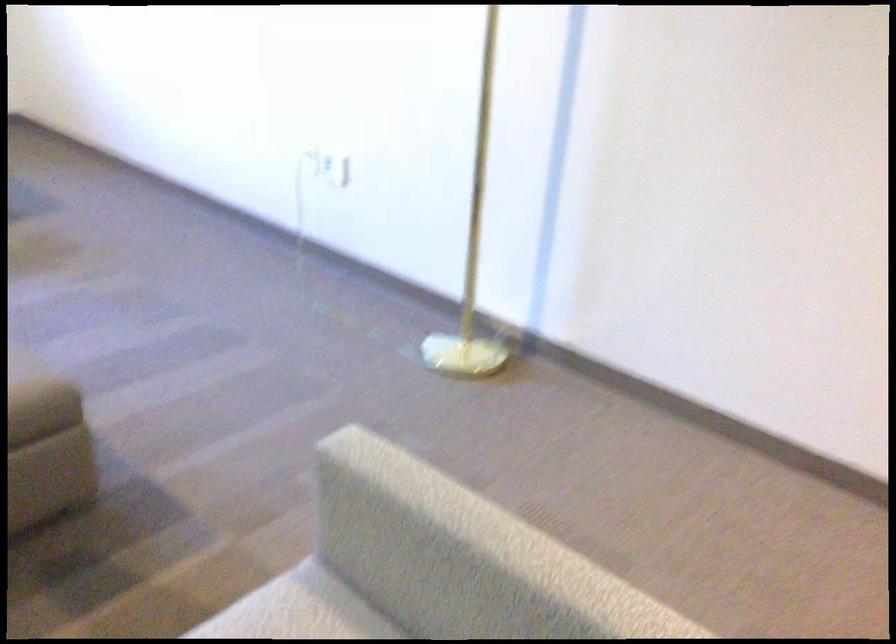
Where would you plugg the white wall socket? Please return your answer as a coordinate pair (x, y).

(330, 166)